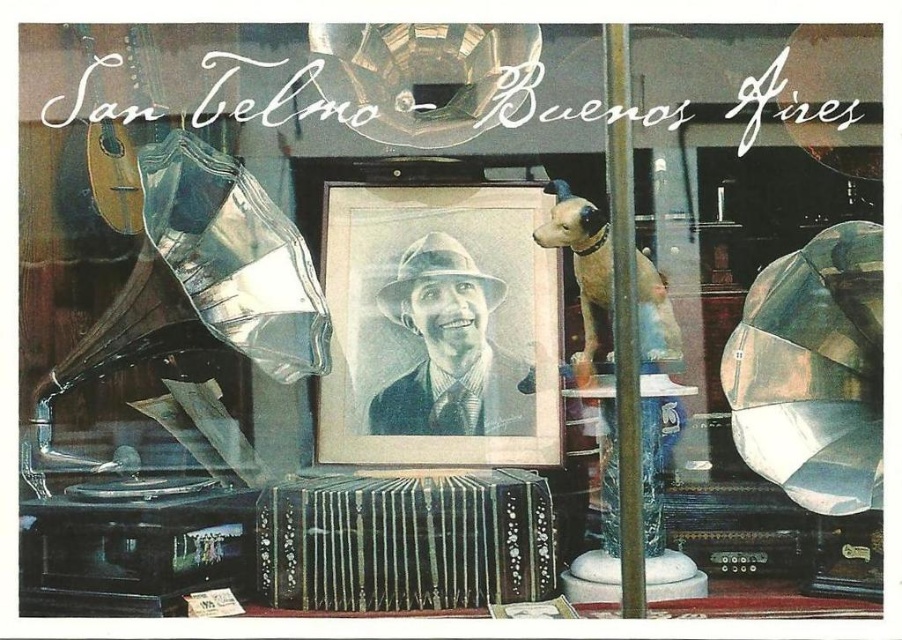
You are standing in front of the shop window display in San Telmo, Buenos Aires. You notice two points marked in the scene. Which point, point (413,497) or point (444,244), is closer to you?

Point (413,497) is closer to the camera than point (444,244).

You are a customer standing in front of the shop window. You notice the black polished wood accordion at center and the black paper portrait at center. Which object is positioned lower in the display?

The black polished wood accordion at center is positioned lower than the black paper portrait at center.